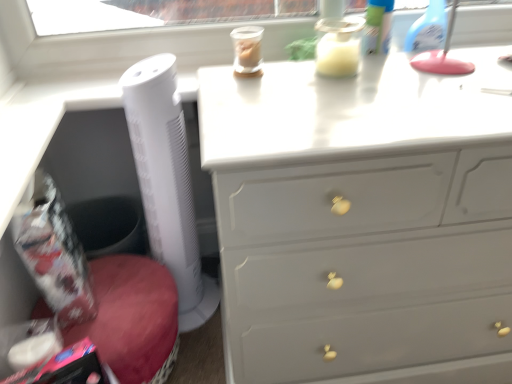
Question: Is white plastic tower fan at left inside the boundaries of white glossy chest of drawers at upper center, or outside?

Choices:
 (A) inside
 (B) outside

Answer: (B)

Question: In terms of size, does white plastic tower fan at left appear bigger or smaller than white glossy chest of drawers at upper center?

Choices:
 (A) big
 (B) small

Answer: (B)

Question: Looking at their shapes, would you say white plastic tower fan at left is wider or thinner than white glossy chest of drawers at upper center?

Choices:
 (A) thin
 (B) wide

Answer: (A)

Question: From a real-world perspective, relative to white plastic tower fan at left, is white glossy chest of drawers at upper center vertically above or below?

Choices:
 (A) below
 (B) above

Answer: (A)

Question: Is white glossy chest of drawers at upper center taller or shorter than white plastic tower fan at left?

Choices:
 (A) tall
 (B) short

Answer: (B)

Question: Is white glossy chest of drawers at upper center spatially inside white plastic tower fan at left, or outside of it?

Choices:
 (A) inside
 (B) outside

Answer: (B)

Question: From the image's perspective, is white glossy chest of drawers at upper center above or below white plastic tower fan at left?

Choices:
 (A) below
 (B) above

Answer: (A)